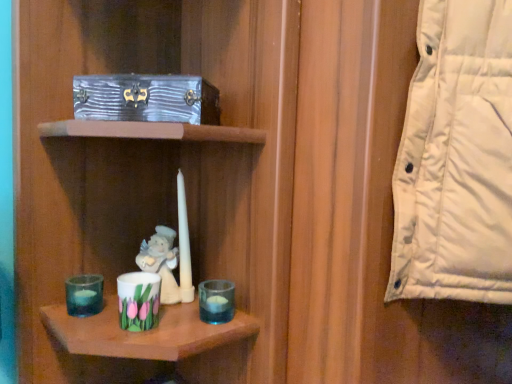
Question: Is porcelain floral cup at lower center, arranged as the 2th candle holder when viewed from the left, bigger than transparent glass candle holder at lower left, the 3th candle holder when ordered from right to left?

Choices:
 (A) no
 (B) yes

Answer: (B)

Question: From the image's perspective, would you say porcelain floral cup at lower center, placed as the 2th candle holder when sorted from right to left, is positioned over transparent glass candle holder at lower left, the 3th candle holder when ordered from right to left?

Choices:
 (A) no
 (B) yes

Answer: (A)

Question: Can you confirm if porcelain floral cup at lower center, placed as the 2th candle holder when sorted from right to left, is taller than transparent glass candle holder at lower left, the 3th candle holder when ordered from right to left?

Choices:
 (A) yes
 (B) no

Answer: (A)

Question: Is the depth of porcelain floral cup at lower center, placed as the 2th candle holder when sorted from right to left, less than that of transparent glass candle holder at lower left, the 3th candle holder when ordered from right to left?

Choices:
 (A) no
 (B) yes

Answer: (B)

Question: From a real-world perspective, does porcelain floral cup at lower center, arranged as the 2th candle holder when viewed from the left, stand above transparent glass candle holder at lower left, acting as the first candle holder starting from the left?

Choices:
 (A) no
 (B) yes

Answer: (B)

Question: From their relative heights in the image, would you say transparent glass candle holder at lower left, the 3th candle holder when ordered from right to left, is taller or shorter than white matte birthday candle at center?

Choices:
 (A) short
 (B) tall

Answer: (A)

Question: Is point (96, 304) positioned closer to the camera than point (182, 241)?

Choices:
 (A) closer
 (B) farther

Answer: (A)

Question: In the image, is transparent glass candle holder at lower left, the 3th candle holder when ordered from right to left, positioned in front of or behind white matte birthday candle at center?

Choices:
 (A) front
 (B) behind

Answer: (A)

Question: From the image's perspective, relative to white matte birthday candle at center, is transparent glass candle holder at lower left, the 3th candle holder when ordered from right to left, above or below?

Choices:
 (A) above
 (B) below

Answer: (B)

Question: Is point (181, 246) positioned closer to the camera than point (211, 281)?

Choices:
 (A) closer
 (B) farther

Answer: (B)

Question: From a real-world perspective, relative to transparent glass candle holder at lower center, the 3th candle holder viewed from the left, is porcelain angel at center vertically above or below?

Choices:
 (A) below
 (B) above

Answer: (B)

Question: From their relative heights in the image, would you say porcelain angel at center is taller or shorter than transparent glass candle holder at lower center, the 3th candle holder viewed from the left?

Choices:
 (A) tall
 (B) short

Answer: (A)

Question: Would you say porcelain angel at center is inside or outside transparent glass candle holder at lower center, arranged as the 1th candle holder when viewed from the right?

Choices:
 (A) outside
 (B) inside

Answer: (A)

Question: Considering the positions of point (181, 114) and point (96, 312), is point (181, 114) closer or farther from the camera than point (96, 312)?

Choices:
 (A) closer
 (B) farther

Answer: (A)

Question: In the image, is metallic silver box at upper left positioned in front of or behind transparent glass candle holder at lower left, acting as the first candle holder starting from the left?

Choices:
 (A) behind
 (B) front

Answer: (B)